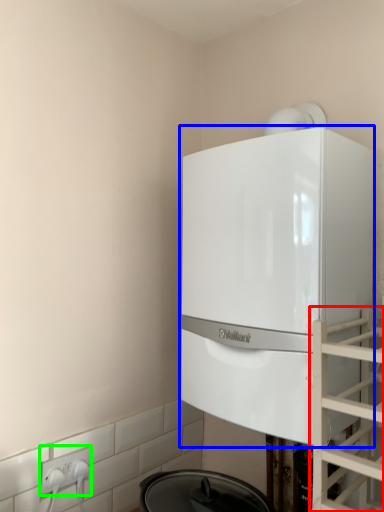
Question: Estimate the real-world distances between objects in this image. Which object is closer to glass door (highlighted by a red box), home appliance (highlighted by a blue box) or electric outlet (highlighted by a green box)?

Choices:
 (A) home appliance
 (B) electric outlet

Answer: (A)